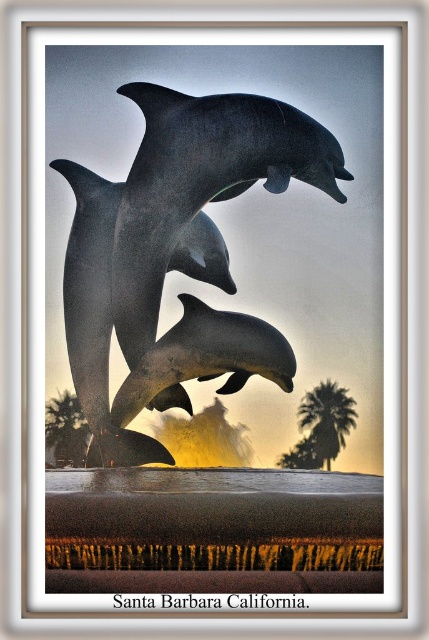
You are standing in front of the sculpture and want to take a photo that includes both the shiny metallic dolphins at center and the green leafy palm tree at lower left. Which object should you ensure is closer to the camera to include both in the frame?

The shiny metallic dolphins at center is positioned over green leafy palm tree at lower left, so you should ensure the shiny metallic dolphins at center is closer to the camera to include both in the frame.

You are standing in front of the sculpture of four dolphins mid leap. You notice two points marked on the sculpture at coordinates point (205, 173) and point (59, 420). Which point is closer to your eyes?

Point (205, 173) is closer to the camera than point (59, 420).

You are standing in front of the sculpture and want to take a photo that includes both the shiny metallic dolphins at center and the green leafy palm tree at lower left. Which object should you focus on first to ensure both are in focus?

You should focus on the shiny metallic dolphins at center first because it is closer to the viewer than the green leafy palm tree at lower left, so focusing on the closer object will help both be in focus.